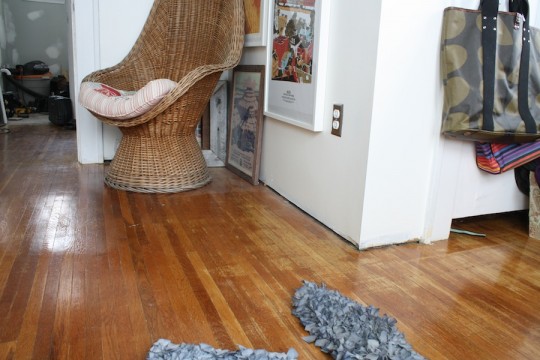
Identify the location of corner of wall. (373, 96).